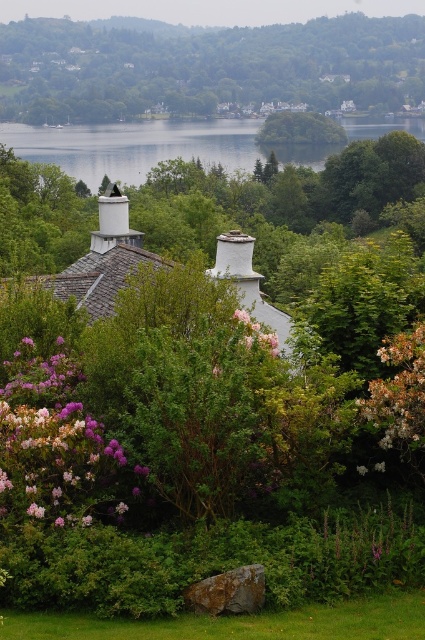
Question: Is clear water at center above white matte chimney at upper center?

Choices:
 (A) yes
 (B) no

Answer: (A)

Question: Can you confirm if purple matte flower at center-right is bigger than white matte chimney at upper center?

Choices:
 (A) yes
 (B) no

Answer: (B)

Question: Which object appears closest to the camera in this image?

Choices:
 (A) pink matte flower at center
 (B) purple matte flower at lower left

Answer: (B)

Question: Which point is farther to the camera?

Choices:
 (A) pink matte flower at center
 (B) purple matte flower at center-right
 (C) green leafy tree at center

Answer: (C)

Question: In this image, where is green leafy tree at center located relative to white matte chimney at upper center?

Choices:
 (A) left
 (B) right

Answer: (B)

Question: Which of the following is the farthest from the observer?

Choices:
 (A) (419, 444)
 (B) (85, 157)

Answer: (B)